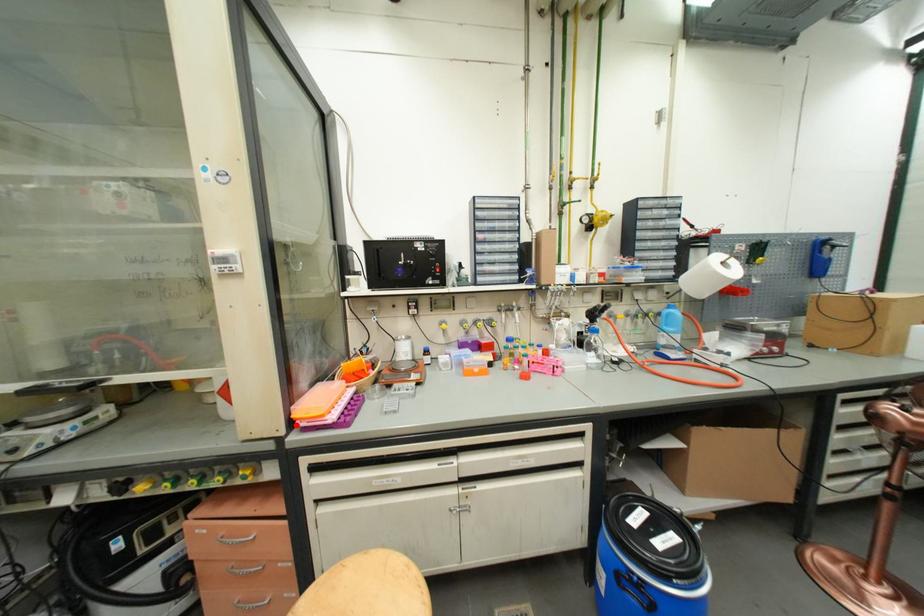
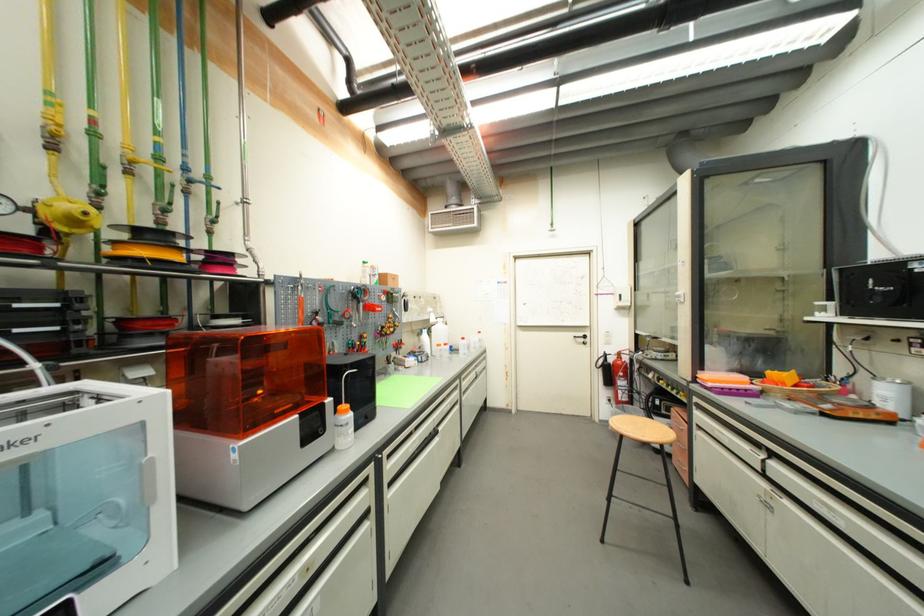
In the second image, find the point that corresponds to the highlighted location in the first image.

(699, 379)